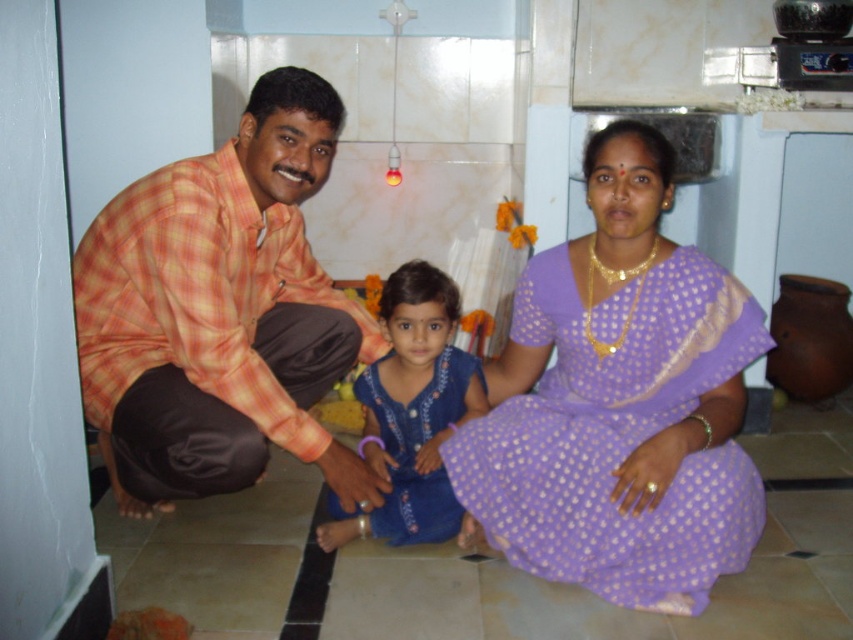
Does purple silk saree at center appear over blue cotton dress at center?

Indeed, purple silk saree at center is positioned over blue cotton dress at center.

Based on the photo, who is positioned more to the left, purple silk saree at center or blue cotton dress at center?

From the viewer's perspective, blue cotton dress at center appears more on the left side.

Is point (645, 129) positioned after point (416, 396)?

No, (645, 129) is in front of (416, 396).

Identify the location of purple silk saree at center. (619, 403).

Can you confirm if purple silk saree at center is positioned to the left of orange plaid shirt at left?

No, purple silk saree at center is not to the left of orange plaid shirt at left.

Does point (766, 339) lie behind point (308, 166)?

That is False.

The width and height of the screenshot is (853, 640). What do you see at coordinates (619, 403) in the screenshot? I see `purple silk saree at center` at bounding box center [619, 403].

Where is `purple silk saree at center`? The height and width of the screenshot is (640, 853). purple silk saree at center is located at coordinates (619, 403).

Is matte orange shirt at left to the left of purple silk saree at center from the viewer's perspective?

Yes, matte orange shirt at left is to the left of purple silk saree at center.

Can you confirm if matte orange shirt at left is taller than purple silk saree at center?

Indeed, matte orange shirt at left has a greater height compared to purple silk saree at center.

Which is behind, point (502, 444) or point (679, 612)?

The point (502, 444) is behind.

Image resolution: width=853 pixels, height=640 pixels. In order to click on matte orange shirt at left in this screenshot , I will do `click(619, 404)`.